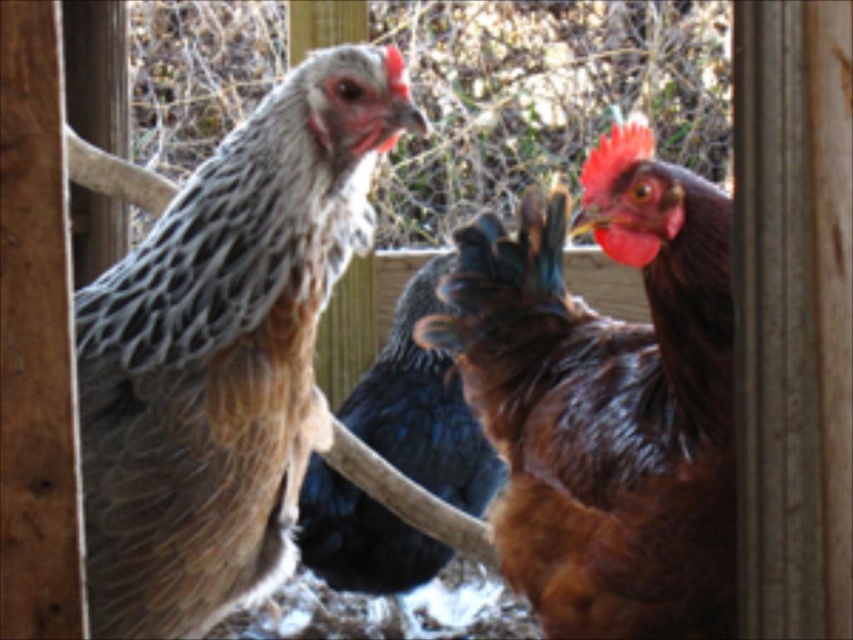
You are a farmer checking the coop. You notice the brown glossy chicken at right and the shiny black feathers at center. Which chicken is positioned higher in the image?

The brown glossy chicken at right is positioned higher than the shiny black feathers at center in the image.

Based on the scene description, where is the speckled feathered chicken at left located in the image?

The speckled feathered chicken at left is located at point (225, 352) in the image.

You are a farmer checking the coop. You notice the speckled feathered chicken at left and the shiny black feathers at center. Which chicken is shorter?

The speckled feathered chicken at left is shorter than the shiny black feathers at center.